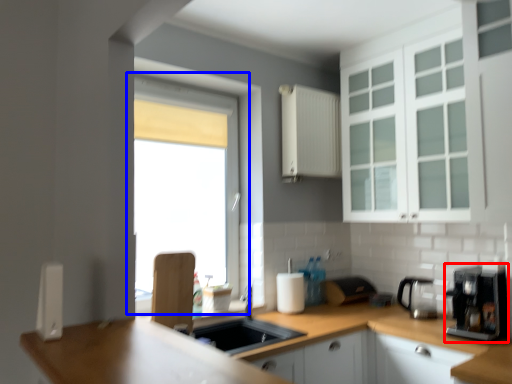
Question: Which object is further to the camera taking this photo, coffee machine (highlighted by a red box) or window (highlighted by a blue box)?

Choices:
 (A) coffee machine
 (B) window

Answer: (B)